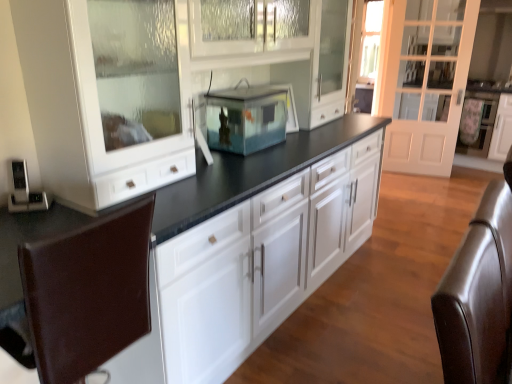
Describe the element at coordinates (262, 261) in the screenshot. I see `white glossy cabinet at center` at that location.

Consider the image. In order to face brown leather swivel chair at right, the 2th swivel chair viewed from the left, should I rotate leftwards or rightwards?

Rotate right and turn 28.221 degrees.

The width and height of the screenshot is (512, 384). What do you see at coordinates (251, 173) in the screenshot? I see `black granite countertop at center` at bounding box center [251, 173].

Find the location of a particular element. The height and width of the screenshot is (384, 512). matte black speaker at left, the second appliance viewed from the right is located at coordinates (25, 191).

Image resolution: width=512 pixels, height=384 pixels. What do you see at coordinates (424, 81) in the screenshot?
I see `white glass door at right` at bounding box center [424, 81].

Identify the location of white glossy cabinet at center. This screenshot has width=512, height=384. (262, 261).

Between transparent glass fish tank at center and brown leather swivel chair at lower left, the second swivel chair when ordered from right to left, which one has larger size?

Bigger between the two is brown leather swivel chair at lower left, the second swivel chair when ordered from right to left.

Which of these two, transparent glass fish tank at center or brown leather swivel chair at lower left, which is counted as the first swivel chair, starting from the left, stands shorter?

transparent glass fish tank at center.

Could you tell me if transparent glass fish tank at center is turned towards brown leather swivel chair at lower left, which is counted as the first swivel chair, starting from the left?

No, transparent glass fish tank at center does not turn towards brown leather swivel chair at lower left, which is counted as the first swivel chair, starting from the left.

Looking at their sizes, would you say black granite countertop at center is wider or thinner than white glossy oven at right, the 1th appliance when ordered from back to front?

Considering their sizes, black granite countertop at center looks broader than white glossy oven at right, the 1th appliance when ordered from back to front.

From the image's perspective, is black granite countertop at center located above or below white glossy oven at right, the 1th appliance when ordered from back to front?

From the image's perspective, black granite countertop at center appears below white glossy oven at right, the 1th appliance when ordered from back to front.

Considering the sizes of objects black granite countertop at center and white glossy oven at right, the 2th appliance positioned from the left, in the image provided, who is bigger, black granite countertop at center or white glossy oven at right, the 2th appliance positioned from the left,?

black granite countertop at center is bigger.

Is black granite countertop at center outside of white glossy oven at right, the 1th appliance from the right?

Indeed, black granite countertop at center is completely outside white glossy oven at right, the 1th appliance from the right.

Visually, is brown leather swivel chair at lower left, which is counted as the first swivel chair, starting from the left, positioned to the left or to the right of white glass door at right?

Clearly, brown leather swivel chair at lower left, which is counted as the first swivel chair, starting from the left, is on the left of white glass door at right in the image.

Which object is wider, brown leather swivel chair at lower left, the second swivel chair when ordered from right to left, or white glass door at right?

Wider between the two is brown leather swivel chair at lower left, the second swivel chair when ordered from right to left.

From the image's perspective, which is above, brown leather swivel chair at lower left, which is counted as the first swivel chair, starting from the left, or white glass door at right?

white glass door at right is shown above in the image.

From the picture: From a real-world perspective, is brown leather swivel chair at lower left, which is counted as the first swivel chair, starting from the left, located beneath white glass door at right?

Yes, from a real-world perspective, brown leather swivel chair at lower left, which is counted as the first swivel chair, starting from the left, is beneath white glass door at right.

In the scene shown: Which of these two, white glossy oven at right, acting as the second appliance starting from the front, or brown leather swivel chair at right, marked as the 1th swivel chair in a right-to-left arrangement, is thinner?

brown leather swivel chair at right, marked as the 1th swivel chair in a right-to-left arrangement, is thinner.

From the image's perspective, is white glossy oven at right, the 2th appliance positioned from the left, above or below brown leather swivel chair at right, the 2th swivel chair viewed from the left?

white glossy oven at right, the 2th appliance positioned from the left, is situated higher than brown leather swivel chair at right, the 2th swivel chair viewed from the left, in the image.

This screenshot has width=512, height=384. I want to click on the 1st swivel chair in front of the white glossy oven at right, the 1th appliance from the right, so click(x=478, y=295).

Is white glossy oven at right, the 1th appliance when ordered from back to front, facing towards brown leather swivel chair at right, the 2th swivel chair viewed from the left?

Yes, white glossy oven at right, the 1th appliance when ordered from back to front, is facing brown leather swivel chair at right, the 2th swivel chair viewed from the left.

Is brown leather swivel chair at lower left, the second swivel chair when ordered from right to left, next to brown leather swivel chair at right, marked as the 1th swivel chair in a right-to-left arrangement?

No, brown leather swivel chair at lower left, the second swivel chair when ordered from right to left, is not making contact with brown leather swivel chair at right, marked as the 1th swivel chair in a right-to-left arrangement.

Between point (115, 306) and point (460, 369), which one is positioned in front?

The point (460, 369) is closer.

Which is more to the left, brown leather swivel chair at lower left, which is counted as the first swivel chair, starting from the left, or brown leather swivel chair at right, marked as the 1th swivel chair in a right-to-left arrangement?

Positioned to the left is brown leather swivel chair at lower left, which is counted as the first swivel chair, starting from the left.

Could you tell me if brown leather swivel chair at lower left, the second swivel chair when ordered from right to left, is facing brown leather swivel chair at right, the 2th swivel chair viewed from the left?

No, brown leather swivel chair at lower left, the second swivel chair when ordered from right to left, is not aimed at brown leather swivel chair at right, the 2th swivel chair viewed from the left.

Does point (83, 366) appear closer or farther from the camera than point (232, 124)?

Point (83, 366) is positioned closer to the camera compared to point (232, 124).

Between brown leather swivel chair at lower left, which is counted as the first swivel chair, starting from the left, and transparent glass fish tank at center, which one has smaller width?

Thinner between the two is transparent glass fish tank at center.

Does brown leather swivel chair at lower left, the second swivel chair when ordered from right to left, appear on the left side of transparent glass fish tank at center?

Indeed, brown leather swivel chair at lower left, the second swivel chair when ordered from right to left, is positioned on the left side of transparent glass fish tank at center.

From the image's perspective, which is below, brown leather swivel chair at lower left, the second swivel chair when ordered from right to left, or transparent glass fish tank at center?

brown leather swivel chair at lower left, the second swivel chair when ordered from right to left, appears lower in the image.

From a real-world perspective, relative to brown leather swivel chair at right, marked as the 1th swivel chair in a right-to-left arrangement, is white glossy cabinet at center vertically above or below?

white glossy cabinet at center is below brown leather swivel chair at right, marked as the 1th swivel chair in a right-to-left arrangement.

How many degrees apart are the facing directions of white glossy cabinet at center and brown leather swivel chair at right, marked as the 1th swivel chair in a right-to-left arrangement?

The angle between the facing direction of white glossy cabinet at center and the facing direction of brown leather swivel chair at right, marked as the 1th swivel chair in a right-to-left arrangement, is 90.5 degrees.

From the image's perspective, between white glossy cabinet at center and brown leather swivel chair at right, the 2th swivel chair viewed from the left, who is located below?

brown leather swivel chair at right, the 2th swivel chair viewed from the left, from the image's perspective.

The height and width of the screenshot is (384, 512). Find the location of `home appliance above the brown leather swivel chair at lower left, which is counted as the first swivel chair, starting from the left (from a real-world perspective)`. home appliance above the brown leather swivel chair at lower left, which is counted as the first swivel chair, starting from the left (from a real-world perspective) is located at coordinates (247, 118).

Locate an element on the screen. The height and width of the screenshot is (384, 512). counter top on the left of white glossy oven at right, acting as the second appliance starting from the front is located at coordinates (251, 173).

Consider the image. Based on their spatial positions, is black granite countertop at center or transparent glass fish tank at center closer to white glossy cabinet at center?

black granite countertop at center is closer to white glossy cabinet at center.

When comparing their distances from matte black speaker at left, which ranks as the 1th appliance in bottom-to-top order, does white glass door at right or brown leather swivel chair at right, the 2th swivel chair viewed from the left, seem further?

Among the two, white glass door at right is located further to matte black speaker at left, which ranks as the 1th appliance in bottom-to-top order.

From the image, which object appears to be nearer to white glass door at right, brown leather swivel chair at lower left, which is counted as the first swivel chair, starting from the left, or black granite countertop at center?

black granite countertop at center.

Based on their spatial positions, is transparent glass fish tank at center or matte black speaker at left, arranged as the 1th appliance when viewed from the left, further from white glass door at right?

Among the two, matte black speaker at left, arranged as the 1th appliance when viewed from the left, is located further to white glass door at right.

When comparing their distances from brown leather swivel chair at lower left, the second swivel chair when ordered from right to left, does brown leather swivel chair at right, marked as the 1th swivel chair in a right-to-left arrangement, or white glass door at right seem further?

Based on the image, white glass door at right appears to be further to brown leather swivel chair at lower left, the second swivel chair when ordered from right to left.

Based on their spatial positions, is white glossy oven at right, placed as the 1th appliance when sorted from top to bottom, or white glass door at right further from brown leather swivel chair at lower left, the second swivel chair when ordered from right to left?

white glossy oven at right, placed as the 1th appliance when sorted from top to bottom, is positioned further to the anchor brown leather swivel chair at lower left, the second swivel chair when ordered from right to left.

When comparing their distances from white glossy cabinet at center, does matte black speaker at left, arranged as the 1th appliance when viewed from the left, or white glossy oven at right, the 2th appliance positioned from the left, seem further?

white glossy oven at right, the 2th appliance positioned from the left.

Considering their positions, is brown leather swivel chair at lower left, which is counted as the first swivel chair, starting from the left, positioned further to matte black speaker at left, which ranks as the 1th appliance in bottom-to-top order, than transparent glass fish tank at center?

The object further to matte black speaker at left, which ranks as the 1th appliance in bottom-to-top order, is transparent glass fish tank at center.

Identify the location of swivel chair between black granite countertop at center and white glossy oven at right, which is the 2th appliance from bottom to top, in the front-back direction. This screenshot has width=512, height=384. point(478,295).

You are a GUI agent. You are given a task and a screenshot of the screen. Output one action in this format:
    pyautogui.click(x=<x>, y=<y>)
    Task: Click on the home appliance situated between matte black speaker at left, arranged as the 1th appliance when viewed from the front, and white glossy cabinet at center from left to right
    Image resolution: width=512 pixels, height=384 pixels.
    Given the screenshot: What is the action you would take?
    pyautogui.click(x=247, y=118)

At what (x,y) coordinates should I click in order to perform the action: click on counter top located between brown leather swivel chair at lower left, which is counted as the first swivel chair, starting from the left, and transparent glass fish tank at center in the depth direction. Please return your answer as a coordinate pair (x, y). This screenshot has width=512, height=384. Looking at the image, I should click on (251, 173).

Locate an element on the screen. Image resolution: width=512 pixels, height=384 pixels. appliance between black granite countertop at center and white glossy oven at right, which is the 2th appliance from bottom to top, in the front-back direction is located at coordinates (25, 191).